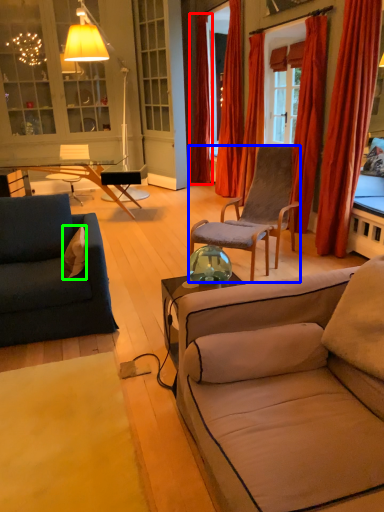
Question: Based on their relative distances, which object is nearer to curtain (highlighted by a red box)? Choose from chair (highlighted by a blue box) and pillow (highlighted by a green box).

Choices:
 (A) chair
 (B) pillow

Answer: (A)